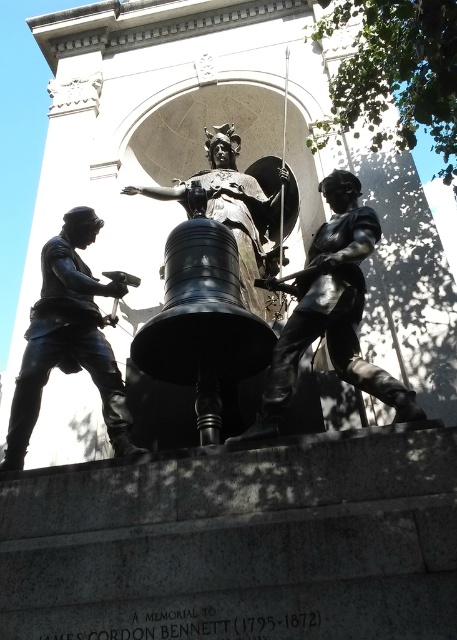
You are standing in front of the monument and want to know which of the two points, point [330,273] or point [52,253], is closer to you. Can you determine this based on the monument layout?

Point [330,273] is closer to the camera than point [52,253], so it is closer to you.

You are standing in front of the monument and want to know how far the point at coordinates point [359,208] is from you. Can you determine the distance?

The point [359,208] is 44.71 meters away from the camera, so the distance from you to the point is approximately 44.71 meters.

You are an art student observing the monument. You notice the shiny bronze statue at center and the bronze statue at left. Which one is closer to you from your viewing position?

The shiny bronze statue at center is closer to you because it is in front of the bronze statue at left.